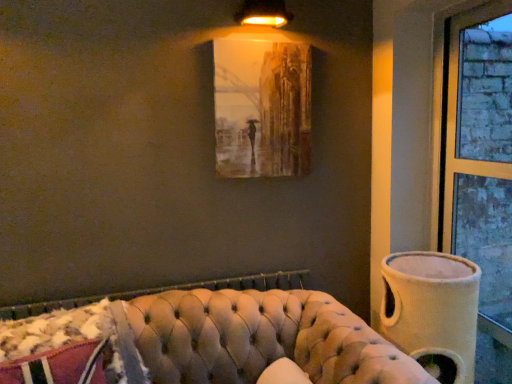
Question: Considering the relative sizes of matte gold lampshade at upper center and tufted leather couch at lower center in the image provided, is matte gold lampshade at upper center shorter than tufted leather couch at lower center?

Choices:
 (A) yes
 (B) no

Answer: (A)

Question: Considering the relative sizes of matte gold lampshade at upper center and tufted leather couch at lower center in the image provided, is matte gold lampshade at upper center taller than tufted leather couch at lower center?

Choices:
 (A) no
 (B) yes

Answer: (A)

Question: Does matte gold lampshade at upper center appear on the right side of tufted leather couch at lower center?

Choices:
 (A) yes
 (B) no

Answer: (A)

Question: From the image's perspective, would you say matte gold lampshade at upper center is shown under tufted leather couch at lower center?

Choices:
 (A) no
 (B) yes

Answer: (A)

Question: Does matte gold lampshade at upper center come behind tufted leather couch at lower center?

Choices:
 (A) no
 (B) yes

Answer: (B)

Question: Is matte gold lampshade at upper center smaller than tufted leather couch at lower center?

Choices:
 (A) no
 (B) yes

Answer: (B)

Question: From the image's perspective, is matte gold lampshade at upper center under brick textured window at right?

Choices:
 (A) no
 (B) yes

Answer: (A)

Question: From the image's perspective, is matte gold lampshade at upper center on brick textured window at right?

Choices:
 (A) no
 (B) yes

Answer: (B)

Question: Is matte gold lampshade at upper center next to brick textured window at right?

Choices:
 (A) no
 (B) yes

Answer: (A)

Question: Would you say matte gold lampshade at upper center is outside brick textured window at right?

Choices:
 (A) yes
 (B) no

Answer: (A)

Question: Can you confirm if matte gold lampshade at upper center is taller than brick textured window at right?

Choices:
 (A) yes
 (B) no

Answer: (B)

Question: Is matte gold lampshade at upper center not close to brick textured window at right?

Choices:
 (A) yes
 (B) no

Answer: (A)

Question: Considering the relative sizes of matte brown painting at upper center and tufted leather couch at lower center in the image provided, is matte brown painting at upper center bigger than tufted leather couch at lower center?

Choices:
 (A) no
 (B) yes

Answer: (A)